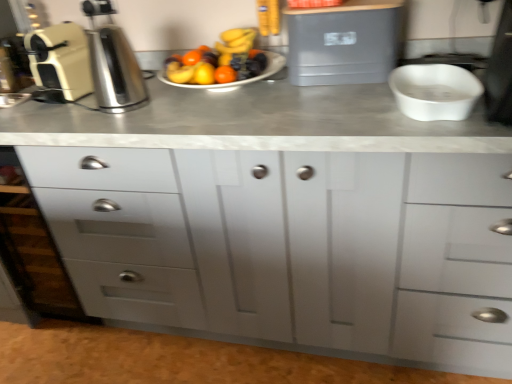
At what (x,y) coordinates should I click in order to perform the action: click on free space that is to the left of white glossy mixing bowl at right. Please return your answer as a coordinate pair (x, y). Looking at the image, I should click on (326, 109).